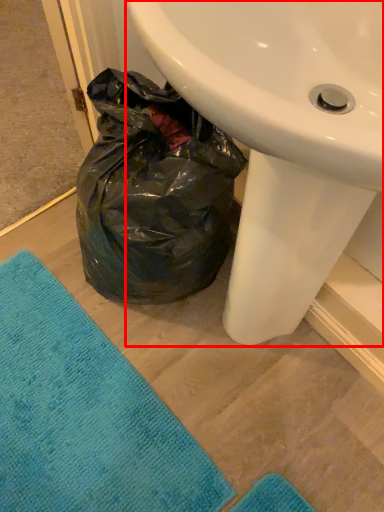
Question: From the image's perspective, where is sink (annotated by the red box) located relative to beach towel?

Choices:
 (A) above
 (B) below

Answer: (A)